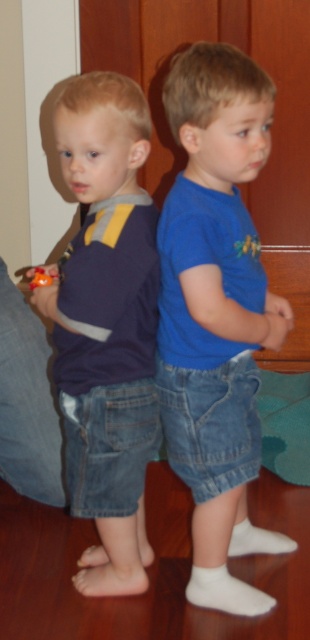
Question: Which point appears closest to the camera in this image?

Choices:
 (A) (51, 275)
 (B) (177, 353)
 (C) (101, 333)

Answer: (C)

Question: Which of these objects is positioned closest to the orange matte toy at lower left?

Choices:
 (A) matte blue shirt at left
 (B) blue denim shorts at center

Answer: (A)

Question: Is blue denim shorts at center further to camera compared to matte blue shirt at left?

Choices:
 (A) no
 (B) yes

Answer: (A)

Question: Is the position of blue denim shorts at center less distant than that of matte blue shirt at left?

Choices:
 (A) no
 (B) yes

Answer: (B)

Question: Does blue denim shorts at center lie behind orange matte toy at lower left?

Choices:
 (A) yes
 (B) no

Answer: (B)

Question: Which point is farther to the camera?

Choices:
 (A) matte blue shirt at left
 (B) blue denim shorts at center
 (C) orange matte toy at lower left

Answer: (C)